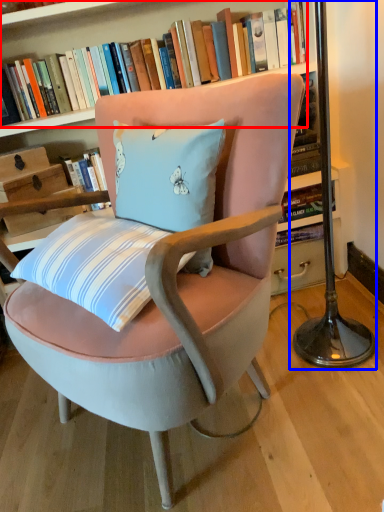
Question: Which object is further to the camera taking this photo, book (highlighted by a red box) or table lamp (highlighted by a blue box)?

Choices:
 (A) book
 (B) table lamp

Answer: (A)